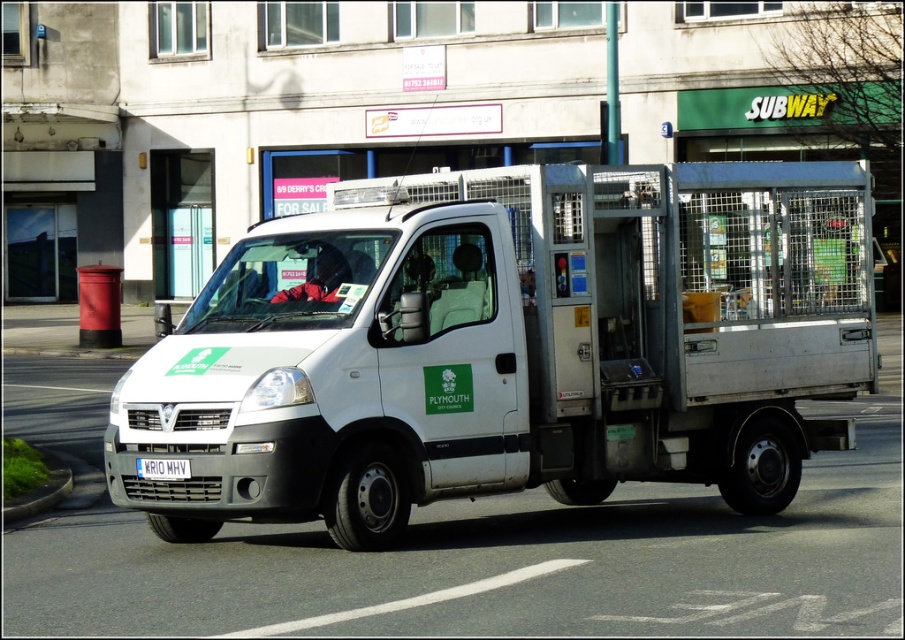
Is white matte van at center positioned at the back of white metallic license plate at center?

That is False.

Does white matte van at center appear under white metallic license plate at center?

Incorrect, white matte van at center is not positioned below white metallic license plate at center.

Who is more distant from viewer, (446, 284) or (148, 460)?

The point (446, 284) is more distant.

Identify the location of white matte van at center. (508, 346).